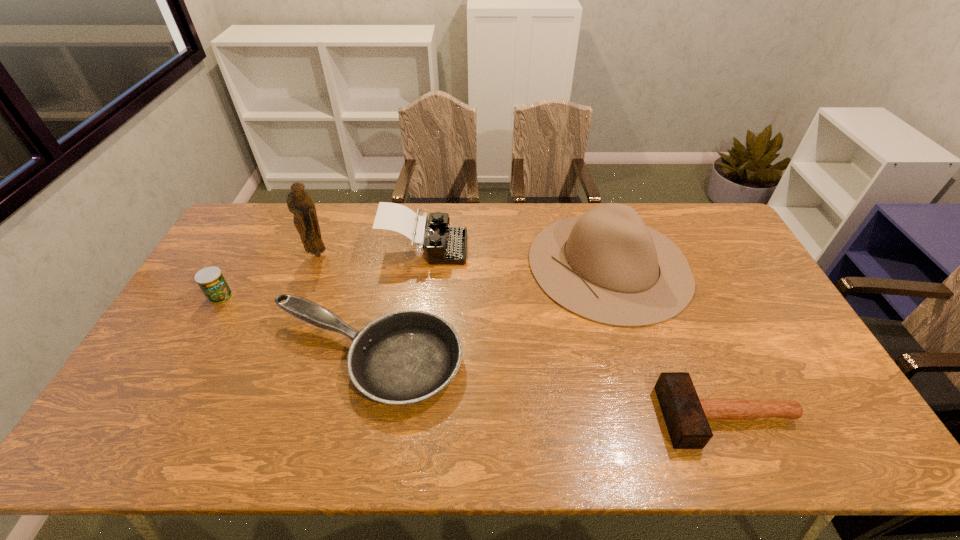
At what (x,y) coordinates should I click in order to perform the action: click on vacant region at the far edge of the desktop. Please return your answer as a coordinate pair (x, y). Image resolution: width=960 pixels, height=540 pixels. Looking at the image, I should click on (421, 207).

Where is `vacant space at the near edge`? This screenshot has height=540, width=960. vacant space at the near edge is located at coordinates (520, 453).

Identify the location of vacant space at the left edge of the desktop. This screenshot has height=540, width=960. (178, 414).

Identify the location of vacant space at the near right corner of the desktop. (x=820, y=429).

This screenshot has width=960, height=540. What are the coordinates of `empty space between the can and the sombrero` in the screenshot? It's located at (415, 281).

Where is `free space between the second tallest object and the shortest object`? The image size is (960, 540). free space between the second tallest object and the shortest object is located at coordinates (668, 341).

This screenshot has height=540, width=960. I want to click on unoccupied position between the tallest object and the frying pan, so click(342, 307).

Locate an element on the screen. The image size is (960, 540). vacant area between the mallet and the figurine is located at coordinates (523, 335).

Where is `vacant space that's between the fourth shortest object and the can`? vacant space that's between the fourth shortest object and the can is located at coordinates (323, 273).

Image resolution: width=960 pixels, height=540 pixels. Find the location of `empty location between the fourth shortest object and the can`. empty location between the fourth shortest object and the can is located at coordinates (323, 273).